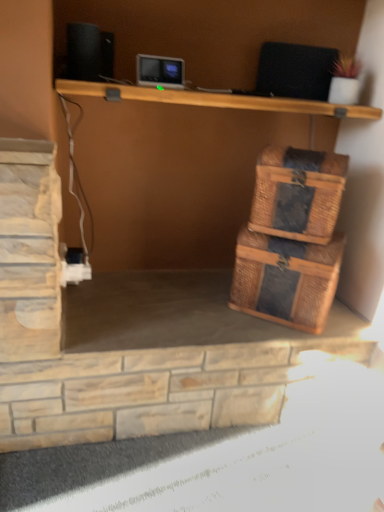
Question: Is black matte speaker at upper left closer to the viewer compared to rattan basket at right?

Choices:
 (A) no
 (B) yes

Answer: (B)

Question: From a real-world perspective, is black matte speaker at upper left positioned under rattan basket at right based on gravity?

Choices:
 (A) no
 (B) yes

Answer: (A)

Question: Is black matte speaker at upper left facing towards rattan basket at right?

Choices:
 (A) no
 (B) yes

Answer: (A)

Question: Is black matte speaker at upper left to the right of rattan basket at right from the viewer's perspective?

Choices:
 (A) yes
 (B) no

Answer: (B)

Question: Can you see black matte speaker at upper left touching rattan basket at right?

Choices:
 (A) yes
 (B) no

Answer: (B)

Question: From the image's perspective, is black matte speaker at upper left positioned above or below rattan woven storage box at lower right?

Choices:
 (A) below
 (B) above

Answer: (B)

Question: Is black matte speaker at upper left in front of or behind rattan woven storage box at lower right in the image?

Choices:
 (A) front
 (B) behind

Answer: (A)

Question: Is point (74, 71) closer or farther from the camera than point (273, 281)?

Choices:
 (A) closer
 (B) farther

Answer: (A)

Question: Is black matte speaker at upper left wider or thinner than rattan woven storage box at lower right?

Choices:
 (A) wide
 (B) thin

Answer: (B)

Question: Choose the correct answer: Is rattan basket at right inside rattan woven storage box at lower right or outside it?

Choices:
 (A) outside
 (B) inside

Answer: (A)

Question: From the image's perspective, is rattan basket at right above or below rattan woven storage box at lower right?

Choices:
 (A) below
 (B) above

Answer: (B)

Question: Considering the positions of rattan basket at right and rattan woven storage box at lower right in the image, is rattan basket at right taller or shorter than rattan woven storage box at lower right?

Choices:
 (A) tall
 (B) short

Answer: (B)

Question: Based on their positions, is rattan basket at right located to the left or right of rattan woven storage box at lower right?

Choices:
 (A) left
 (B) right

Answer: (B)

Question: Choose the correct answer: Is rattan woven storage box at lower right inside black matte speaker at upper left or outside it?

Choices:
 (A) inside
 (B) outside

Answer: (B)

Question: Considering the positions of rattan woven storage box at lower right and black matte speaker at upper left in the image, is rattan woven storage box at lower right bigger or smaller than black matte speaker at upper left?

Choices:
 (A) small
 (B) big

Answer: (B)